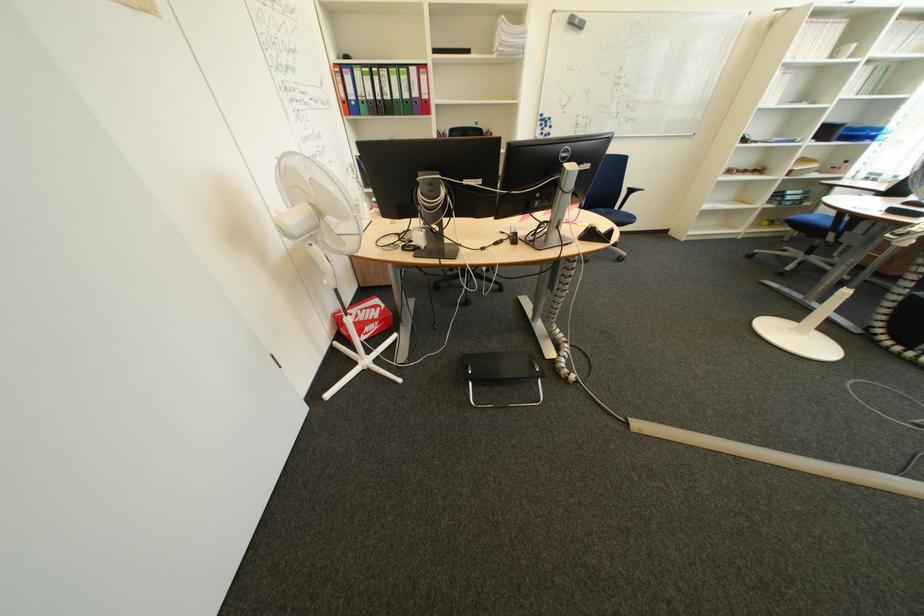
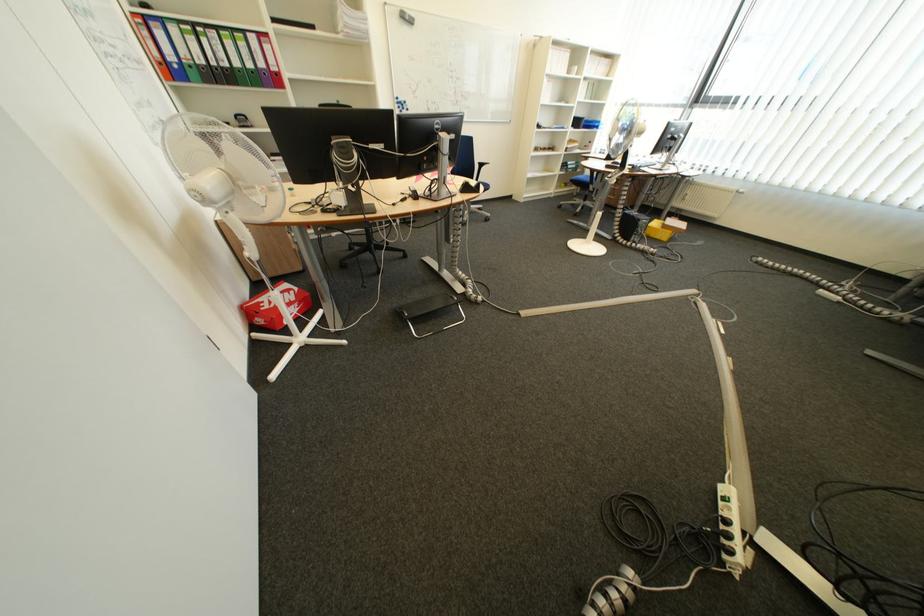
Question: The camera is either moving clockwise (left) or counter-clockwise (right) around the object. The first image is from the beginning of the video and the second image is from the end. Is the camera moving left or right when shooting the video?

Choices:
 (A) Left
 (B) Right

Answer: (A)